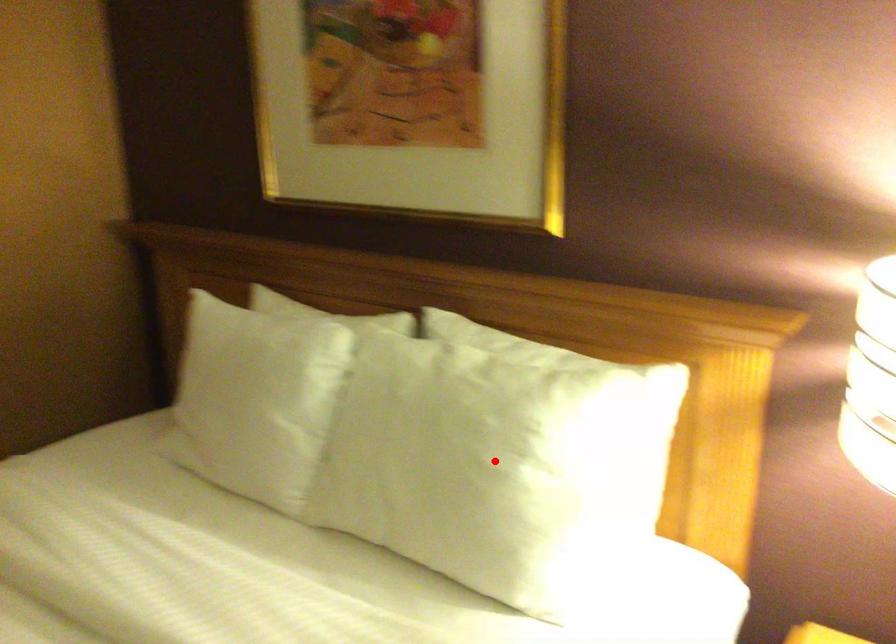
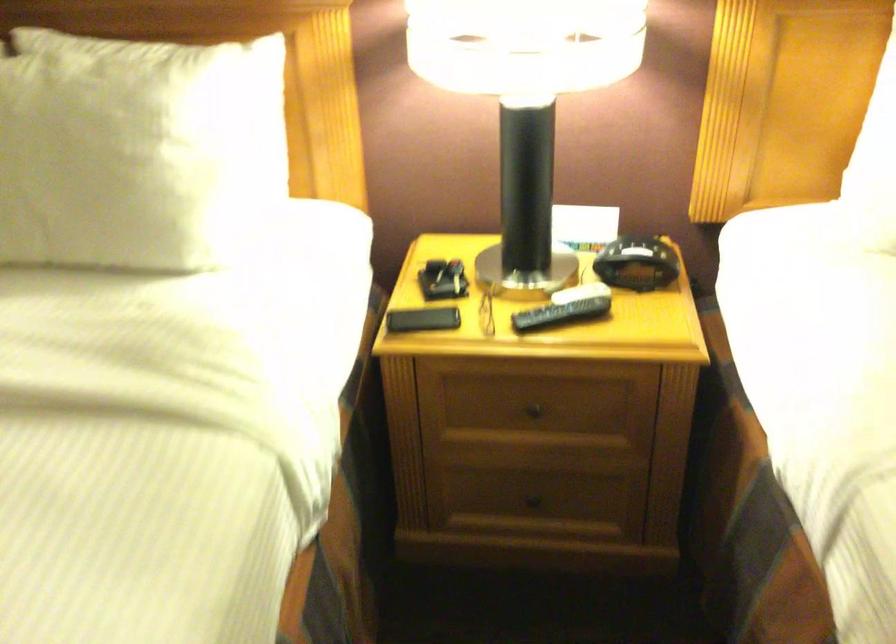
In the second image, find the point that corresponds to the highlighted location in the first image.

(134, 149)